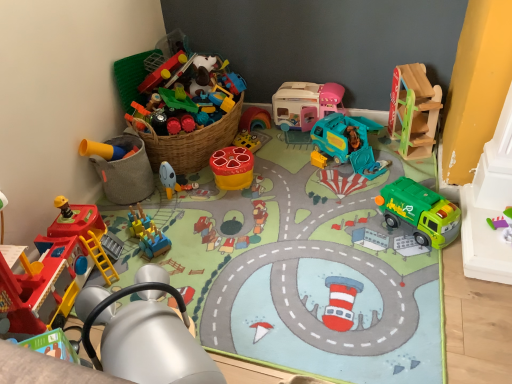
Question: Is point (153, 185) closer or farther from the camera than point (120, 289)?

Choices:
 (A) closer
 (B) farther

Answer: (B)

Question: Do you think yellow matte bucket at lower left, the 9th toy when ordered from right to left, is within metallic yellow crane at lower left, which is counted as the 4th toy, starting from the left, or outside of it?

Choices:
 (A) outside
 (B) inside

Answer: (A)

Question: Which object is positioned farthest from the matte plastic toy at center, the 7th toy viewed from the right?

Choices:
 (A) blue plastic train at center, acting as the 8th toy starting from the right
 (B) matte plastic stool at center, the fifth toy from the left
 (C) wooden slide at upper right, marked as the 1th toy in a right-to-left arrangement
 (D) pastel pink plastic camper at center, which ranks as the fourth toy in right-to-left order
 (E) metallic yellow crane at lower left, the sixth toy from the right

Answer: (C)

Question: Estimate the real-world distances between objects in this image. Which object is closer to the teal plastic garbage truck at center, marked as the 3th toy in a right-to-left arrangement?

Choices:
 (A) matte plastic stool at center, the fifth toy from the left
 (B) yellow matte bucket at lower left, the 9th toy when ordered from right to left
 (C) green plastic garbage truck at lower right, which appears as the second toy when viewed from the right
 (D) metallic yellow crane at lower left, the sixth toy from the right
 (E) blue plastic train at center, acting as the 8th toy starting from the right

Answer: (C)